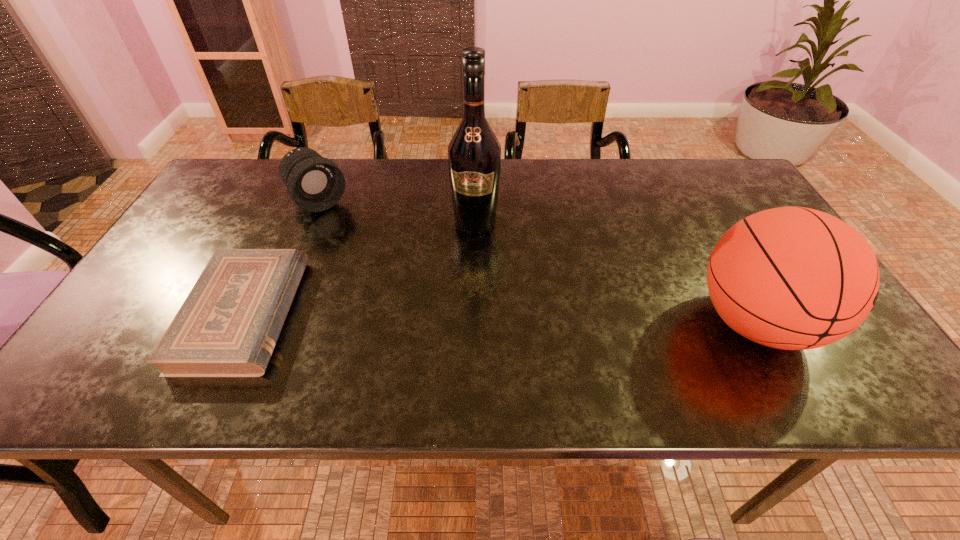
In order to click on free space located 0.300m on the label of the tallest object in this screenshot , I will do `click(460, 329)`.

At what (x,y) coordinates should I click in order to perform the action: click on vacant area situated at the front element of the third tallest object. Please return your answer as a coordinate pair (x, y). Image resolution: width=960 pixels, height=540 pixels. Looking at the image, I should click on click(x=408, y=300).

Where is `vacant position located 0.220m at the front element of the third tallest object`? vacant position located 0.220m at the front element of the third tallest object is located at coordinates (372, 260).

Find the location of a particular element. Image resolution: width=960 pixels, height=540 pixels. free point located 0.280m at the front element of the third tallest object is located at coordinates (384, 273).

Find the location of a particular element. object at the far edge is located at coordinates (315, 183).

Locate an element on the screen. Bible positioned at the near edge is located at coordinates (228, 326).

Locate an element on the screen. Image resolution: width=960 pixels, height=540 pixels. basketball that is at the near edge is located at coordinates (793, 278).

The height and width of the screenshot is (540, 960). Identify the location of object situated at the right edge. (793, 278).

Where is `object present at the near right corner`? The height and width of the screenshot is (540, 960). object present at the near right corner is located at coordinates (793, 278).

Locate an element on the screen. free spot at the far edge of the desktop is located at coordinates (382, 165).